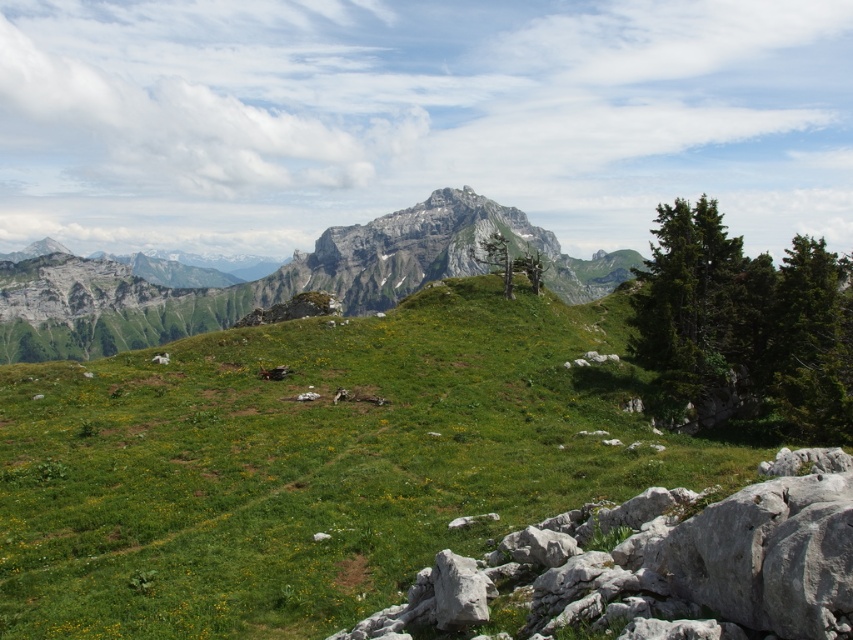
Can you confirm if green grassy hillside at center is taller than white rock at lower right?

Yes.

Which of these two, green grassy hillside at center or white rock at lower right, stands taller?

With more height is green grassy hillside at center.

Which is behind, point (207, 506) or point (850, 566)?

The point (207, 506) is behind.

The width and height of the screenshot is (853, 640). Find the location of `green grassy hillside at center`. green grassy hillside at center is located at coordinates (312, 464).

Which is behind, point (308, 497) or point (409, 289)?

The point (409, 289) is behind.

What do you see at coordinates (312, 464) in the screenshot?
I see `green grassy hillside at center` at bounding box center [312, 464].

Describe the element at coordinates (312, 464) in the screenshot. Image resolution: width=853 pixels, height=640 pixels. I see `green grassy hillside at center` at that location.

The image size is (853, 640). In order to click on green grassy hillside at center in this screenshot , I will do `click(312, 464)`.

Who is higher up, white rock at lower right or rugged stone mountain at center?

rugged stone mountain at center

This screenshot has height=640, width=853. What do you see at coordinates (666, 564) in the screenshot?
I see `white rock at lower right` at bounding box center [666, 564].

Where is `white rock at lower right`? This screenshot has width=853, height=640. white rock at lower right is located at coordinates (666, 564).